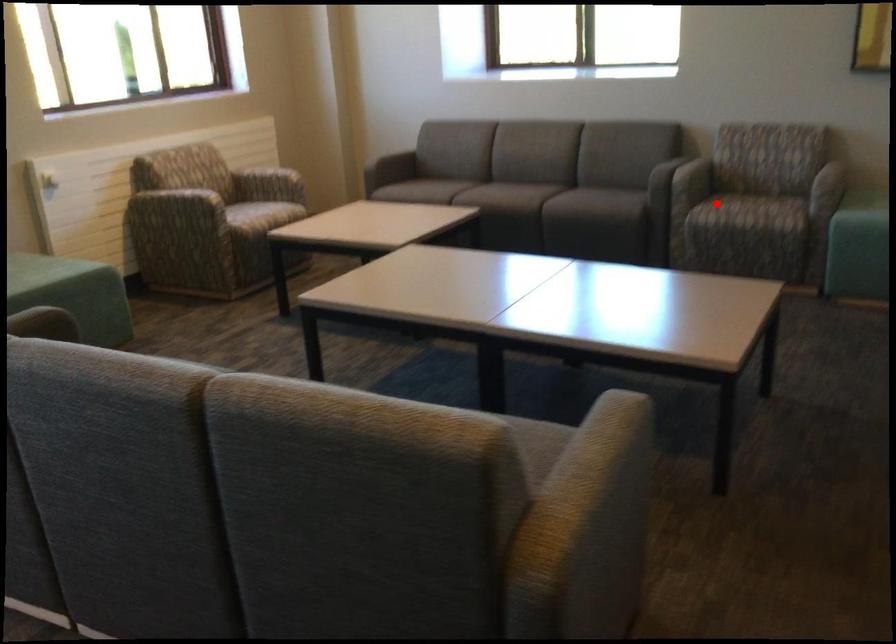
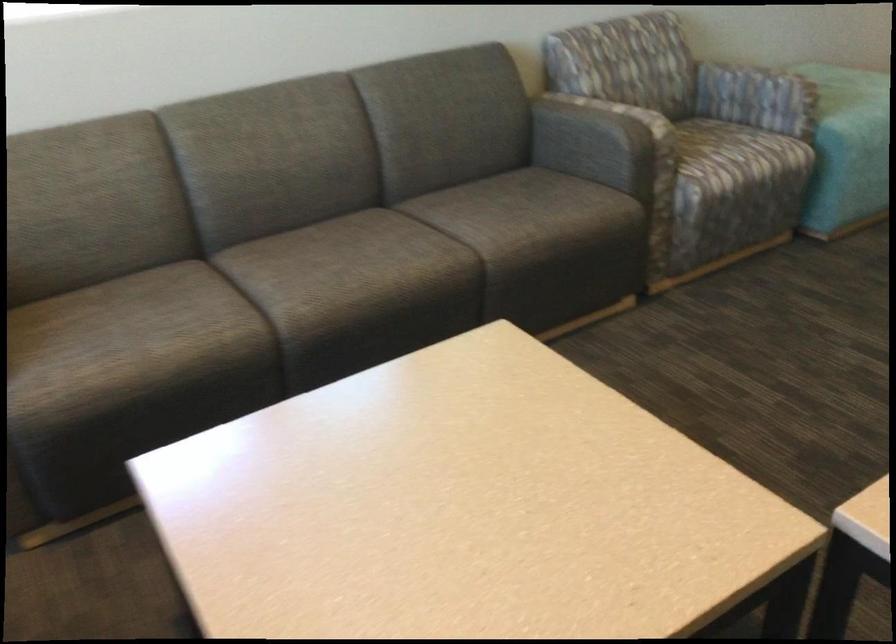
In the second image, find the point that corresponds to the highlighted location in the first image.

(737, 155)